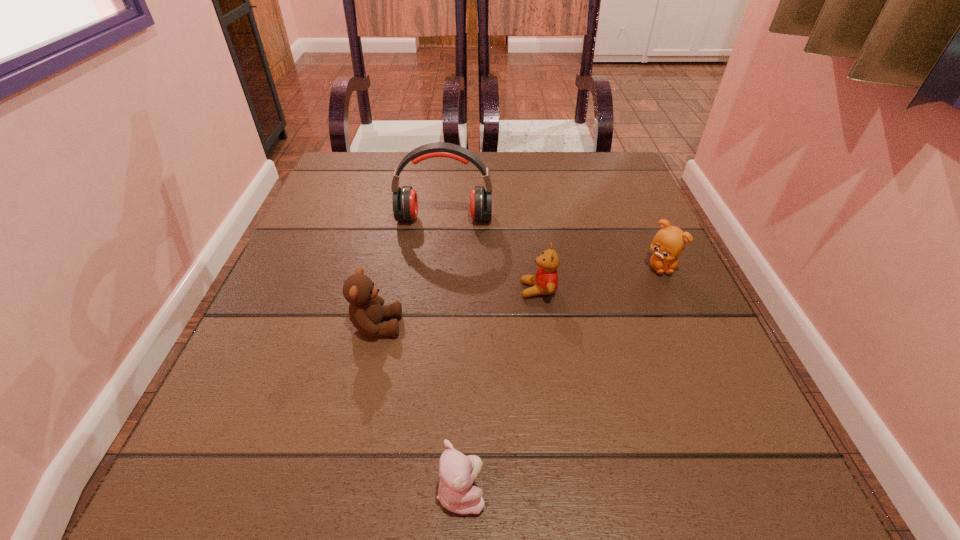
Where is `free space located 0.110m on the face of the rightmost teddy bear`? The image size is (960, 540). free space located 0.110m on the face of the rightmost teddy bear is located at coordinates (684, 321).

Find the location of `vacant space located 0.240m on the front-facing side of the second object from right to left`. vacant space located 0.240m on the front-facing side of the second object from right to left is located at coordinates (392, 290).

Locate an element on the screen. The height and width of the screenshot is (540, 960). vacant space situated on the front-facing side of the second object from right to left is located at coordinates (326, 290).

This screenshot has width=960, height=540. Find the location of `free space located 0.300m on the front-facing side of the second object from right to left`. free space located 0.300m on the front-facing side of the second object from right to left is located at coordinates (359, 290).

This screenshot has width=960, height=540. I want to click on free location located 0.200m at the face of the nearest teddy bear, so click(643, 491).

Find the location of a particular element. Image resolution: width=960 pixels, height=540 pixels. object that is at the near edge is located at coordinates (457, 472).

Identify the location of object that is at the right edge. 669,242.

The width and height of the screenshot is (960, 540). What are the coordinates of `vacant space at the far edge of the desktop` in the screenshot? It's located at (507, 171).

Identify the location of vacant region at the near edge of the desktop. (649, 508).

Locate an element on the screen. Image resolution: width=960 pixels, height=540 pixels. vacant space at the left edge is located at coordinates click(x=204, y=428).